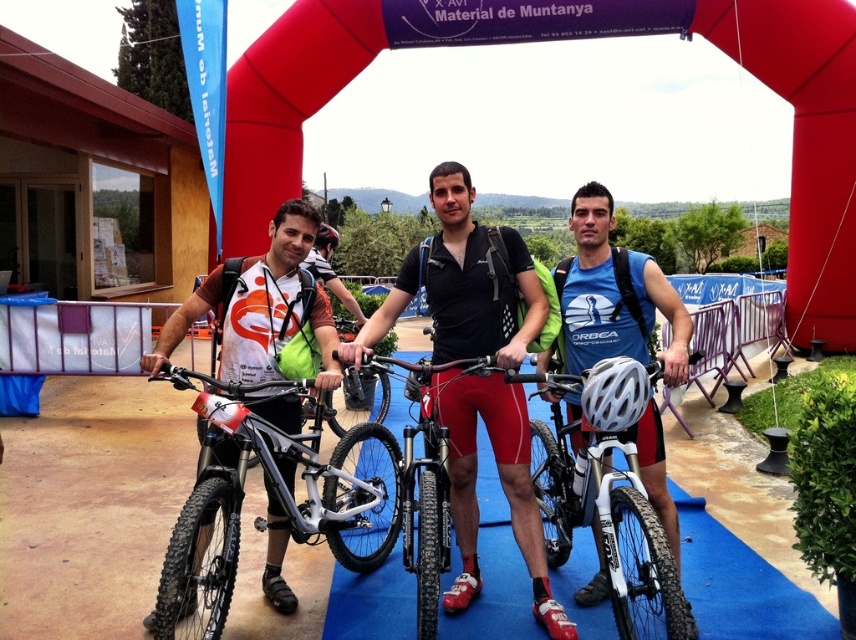
Question: Which point is closer to the camera?

Choices:
 (A) (432, 621)
 (B) (330, 228)

Answer: (A)

Question: Observing the image, what is the correct spatial positioning of blue matte jersey at center in reference to matte black helmet at center?

Choices:
 (A) below
 (B) above

Answer: (A)

Question: Which point appears farthest from the camera in this image?

Choices:
 (A) click(x=610, y=401)
 (B) click(x=377, y=548)

Answer: (B)

Question: Can you confirm if silver metallic bicycle at center is thinner than white matte bicycle helmet at center?

Choices:
 (A) no
 (B) yes

Answer: (A)

Question: Among these points, which one is farthest from the camera?

Choices:
 (A) (486, 394)
 (B) (595, 422)
 (C) (568, 285)

Answer: (C)

Question: Can you confirm if matte black bicycle at center is positioned to the right of white matte bicycle helmet at center?

Choices:
 (A) yes
 (B) no

Answer: (B)